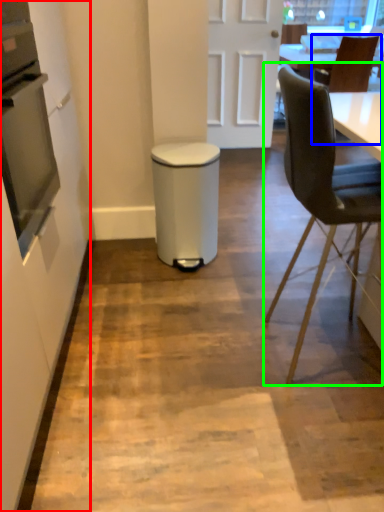
Question: Which is farther away from side (highlighted by a red box)? chair (highlighted by a blue box) or chair (highlighted by a green box)?

Choices:
 (A) chair
 (B) chair

Answer: (A)